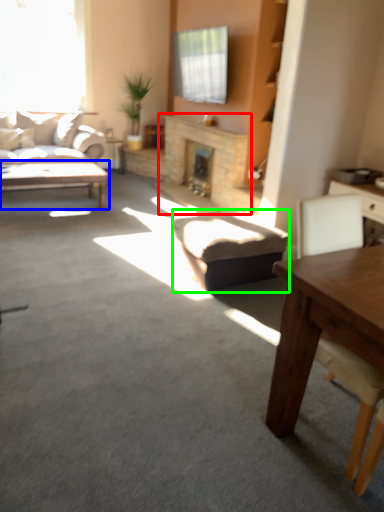
Question: Which object is positioned closest to fireplace (highlighted by a red box)? Select from coffee table (highlighted by a blue box) and stool (highlighted by a green box).

Choices:
 (A) coffee table
 (B) stool

Answer: (A)